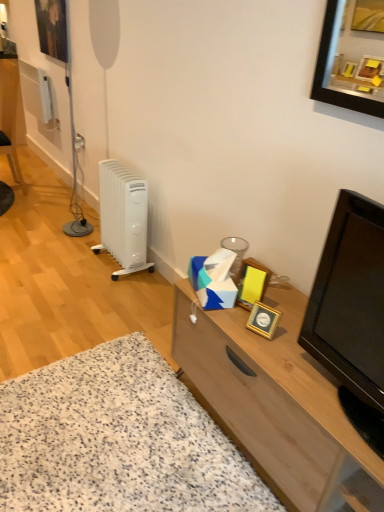
This screenshot has width=384, height=512. I want to click on free space to the left of gold metallic picture frame at center-right, the 2th picture frame when ordered from top to bottom, so click(217, 307).